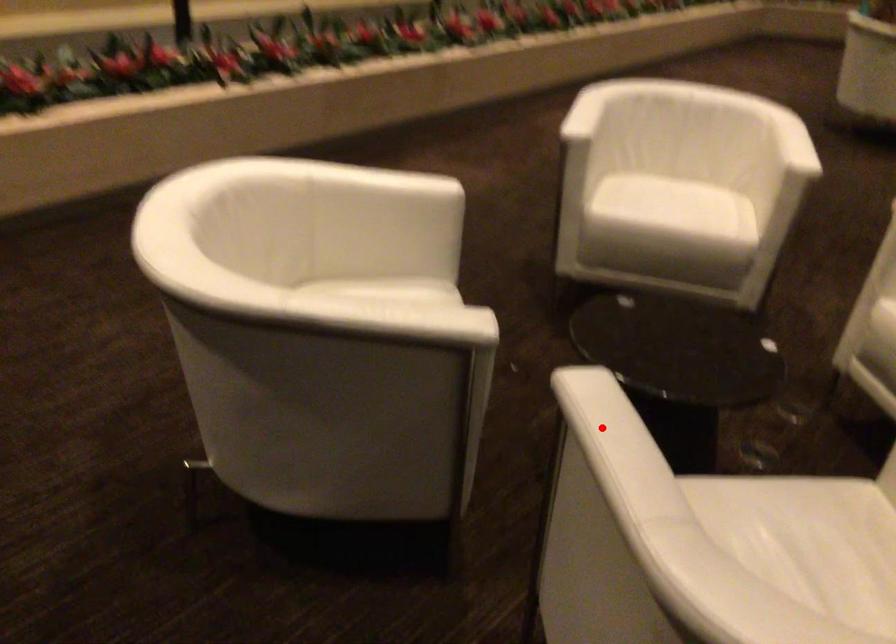
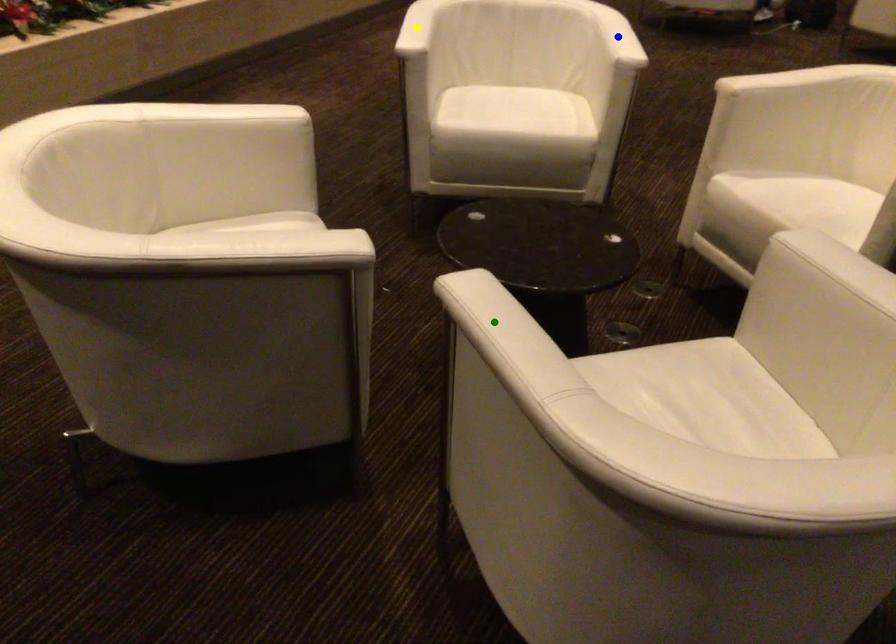
Question: I am providing you with two images of the same scene from different viewpoints. A red point is marked on the first image. You are given multiple points on the second image. Which mark in image 2 goes with the point in image 1?

Choices:
 (A) blue point
 (B) green point
 (C) yellow point

Answer: (B)